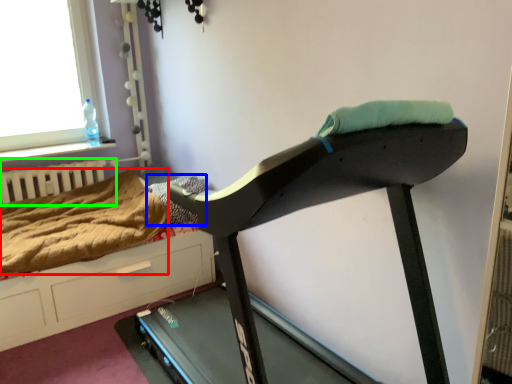
Question: Which object is the closest to the blanket (highlighted by a red box)? Choose among these: blanket (highlighted by a blue box) or radiator (highlighted by a green box).

Choices:
 (A) blanket
 (B) radiator

Answer: (B)